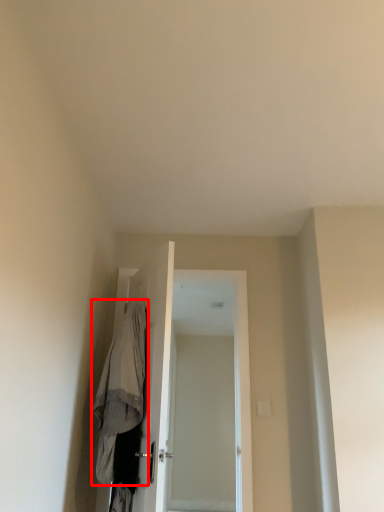
Question: From the image's perspective, what is the correct spatial positioning of robe (annotated by the red box) in reference to screen door?

Choices:
 (A) below
 (B) above

Answer: (B)